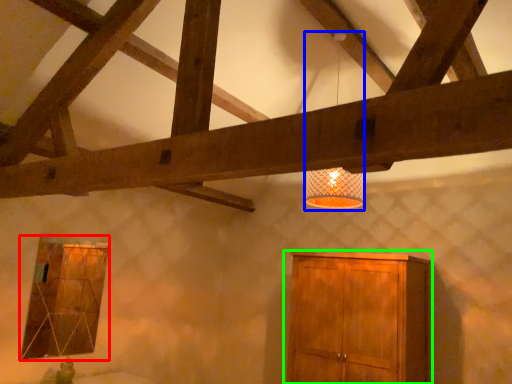
Question: Based on their relative distances, which object is farther from window (highlighted by a red box)? Choose from lamp (highlighted by a blue box) and cupboard (highlighted by a green box).

Choices:
 (A) lamp
 (B) cupboard

Answer: (A)